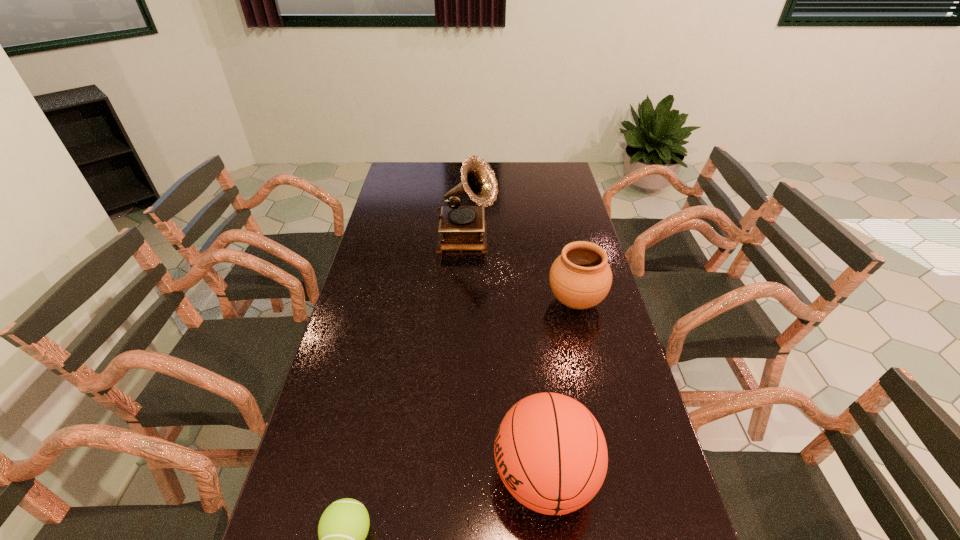
At what (x,y) coordinates should I click in order to perform the action: click on basketball that is at the right edge. Please return your answer as a coordinate pair (x, y). Looking at the image, I should click on (551, 454).

The width and height of the screenshot is (960, 540). I want to click on pottery that is positioned at the right edge, so click(x=580, y=278).

Where is `free space at the far edge`? free space at the far edge is located at coordinates (455, 178).

You are a GUI agent. You are given a task and a screenshot of the screen. Output one action in this format:
    pyautogui.click(x=<x>, y=<y>)
    Task: Click on the vacant region at the left edge of the desktop
    
    Given the screenshot: What is the action you would take?
    pyautogui.click(x=323, y=485)

Where is `blank space at the right edge`? The height and width of the screenshot is (540, 960). blank space at the right edge is located at coordinates (595, 372).

Locate an element on the screen. The image size is (960, 540). vacant region at the far right corner of the desktop is located at coordinates (565, 172).

This screenshot has width=960, height=540. I want to click on free spot between the tallest object and the basketball, so click(x=506, y=359).

Locate an element on the screen. The height and width of the screenshot is (540, 960). empty space that is in between the tallest object and the third tallest object is located at coordinates (521, 271).

Where is `vacant space in between the pottery and the second tallest object`? The width and height of the screenshot is (960, 540). vacant space in between the pottery and the second tallest object is located at coordinates (561, 389).

Identify the location of free space between the record player and the pottery. This screenshot has width=960, height=540. (521, 271).